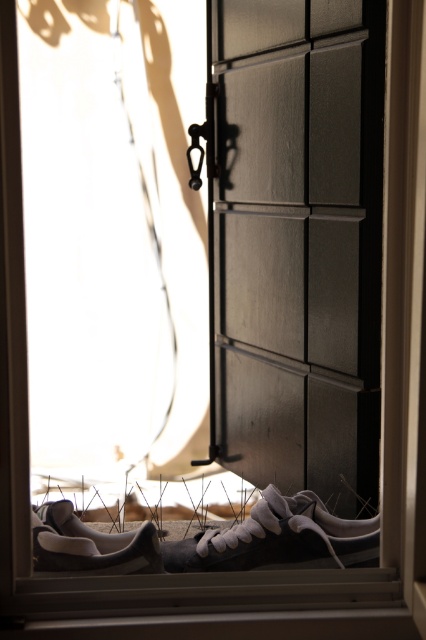
Does matte black door at center have a greater width compared to suede/leather sneaker at lower center?

Indeed, matte black door at center has a greater width compared to suede/leather sneaker at lower center.

Can you confirm if matte black door at center is taller than suede/leather sneaker at lower center?

Indeed, matte black door at center has a greater height compared to suede/leather sneaker at lower center.

Between point (224, 406) and point (204, 564), which one is positioned behind?

Positioned behind is point (224, 406).

Find the location of a particular element. The height and width of the screenshot is (640, 426). matte black door at center is located at coordinates (299, 243).

Identify the location of matte black door at center. The image size is (426, 640). (299, 243).

Measure the distance between point (305, 289) and camera.

A distance of 2.28 meters exists between point (305, 289) and camera.

Is point (229, 28) more distant than point (158, 570)?

Yes, it is.

Find the location of a particular element. This screenshot has height=640, width=426. matte black door at center is located at coordinates (299, 243).

Can you confirm if suede/leather sneaker at lower center is wider than white suede shoe at lower left?

Yes.

The width and height of the screenshot is (426, 640). What do you see at coordinates (278, 538) in the screenshot? I see `suede/leather sneaker at lower center` at bounding box center [278, 538].

Who is more distant from viewer, (273, 538) or (40, 528)?

Point (273, 538)

The width and height of the screenshot is (426, 640). Find the location of `suede/leather sneaker at lower center`. suede/leather sneaker at lower center is located at coordinates (278, 538).